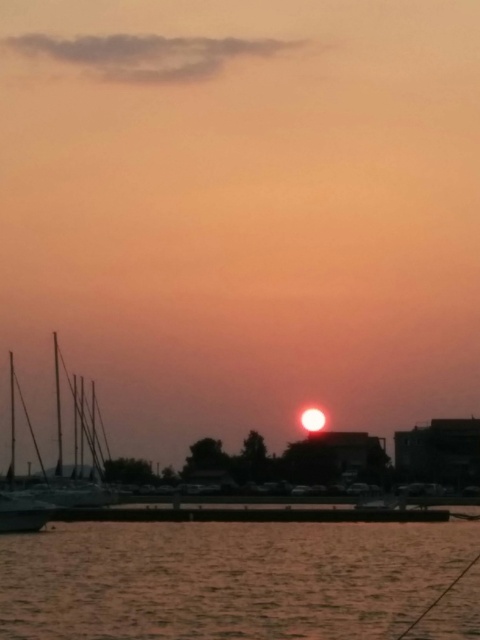
Locate an element on the screen. Image resolution: width=480 pixels, height=640 pixels. smooth water at lower center is located at coordinates [226, 579].

Between smooth water at lower center and silvery metallic masts at left, which one has less height?

smooth water at lower center

Which is behind, point (269, 593) or point (95, 435)?

Point (95, 435)

This screenshot has width=480, height=640. Find the location of `smooth water at lower center`. smooth water at lower center is located at coordinates (226, 579).

Which of these two, silvery metallic masts at left or silvery metallic sailboat at left, stands shorter?

silvery metallic sailboat at left is shorter.

Does silvery metallic masts at left lie in front of silvery metallic sailboat at left?

No, silvery metallic masts at left is further to the viewer.

Measure the distance between silvery metallic masts at left and camera.

silvery metallic masts at left and camera are 200.69 feet apart from each other.

Find the location of a particular element. The width and height of the screenshot is (480, 640). silvery metallic masts at left is located at coordinates (79, 449).

Which is in front, point (220, 531) or point (10, 369)?

Positioned in front is point (220, 531).

Measure the distance between smooth water at lower center and camera.

smooth water at lower center and camera are 18.63 meters apart from each other.

Which is behind, point (23, 604) or point (39, 516)?

The point (39, 516) is more distant.

Identify the location of smooth water at lower center. (226, 579).